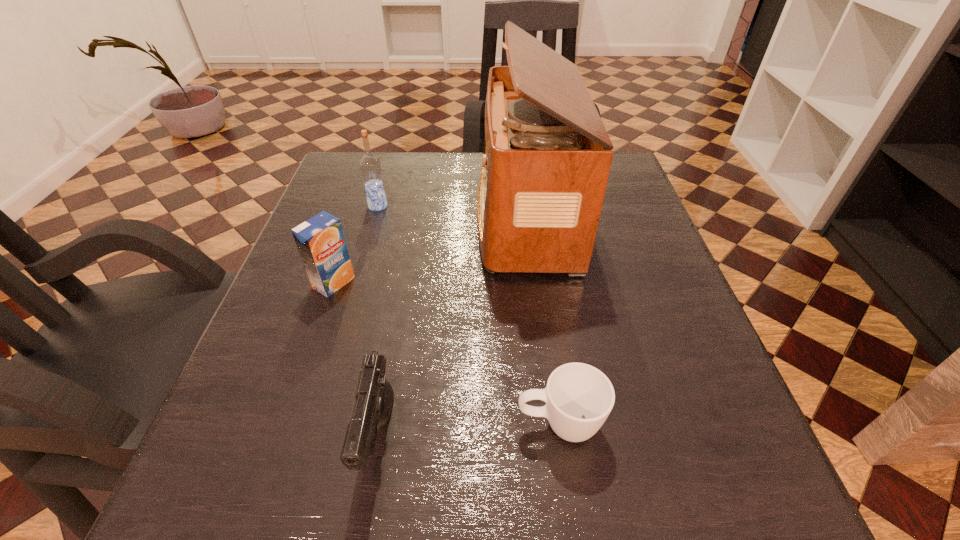
Identify the location of free spot located on the back of the orange_juice. Image resolution: width=960 pixels, height=540 pixels. (357, 213).

Locate an element on the screen. This screenshot has height=540, width=960. vacant space located 0.210m with the handle on the side of the shortest object is located at coordinates pos(368,424).

Locate an element on the screen. Image resolution: width=960 pixels, height=540 pixels. vacant space situated 0.090m with the handle on the side of the shortest object is located at coordinates (452, 424).

This screenshot has height=540, width=960. Identify the location of vacant space located 0.180m with the handle on the side of the shortest object. (389, 424).

Image resolution: width=960 pixels, height=540 pixels. I want to click on radio receiver at the far edge, so click(x=547, y=155).

Image resolution: width=960 pixels, height=540 pixels. I want to click on vodka that is at the far edge, so click(370, 167).

Locate an element on the screen. The image size is (960, 540). object positioned at the near edge is located at coordinates pyautogui.click(x=372, y=407).

Locate an element on the screen. The image size is (960, 540). vodka that is positioned at the left edge is located at coordinates (370, 167).

Where is `orange_juice present at the left edge`? Image resolution: width=960 pixels, height=540 pixels. orange_juice present at the left edge is located at coordinates (320, 240).

The image size is (960, 540). In order to click on object that is at the far left corner in this screenshot , I will do `click(370, 167)`.